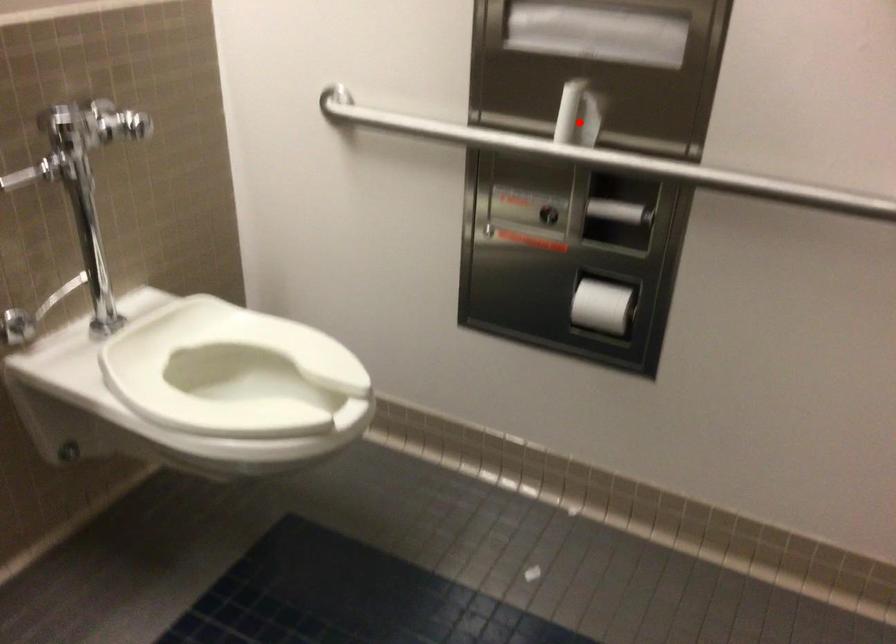
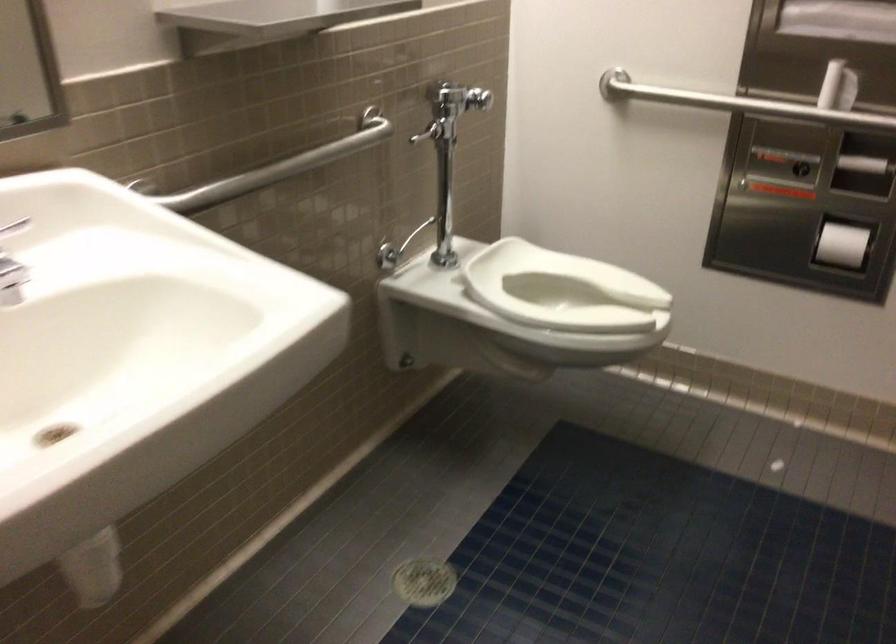
Question: A red point is marked in image1. In image2, is the corresponding 3D point closer to the camera or farther? Reply with the corresponding letter.

Choices:
 (A) The corresponding 3D point is closer.
 (B) The corresponding 3D point is farther.

Answer: (B)